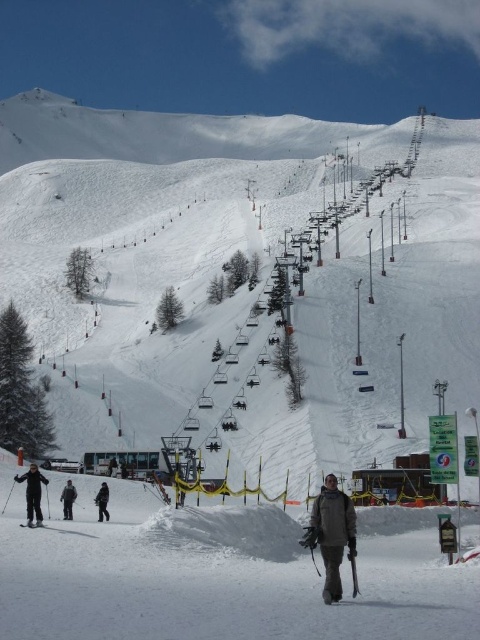
You are a photographer standing at the top of the mountain, looking down at the scene. You want to take a photo that includes both the dark gray jacket at lower center and the black matte jacket at lower left. Which jacket will appear closer to the bottom of the photo?

The black matte jacket at lower left will appear closer to the bottom of the photo because the dark gray jacket at lower center is located above it.

You are a photographer positioned at the top of the mountain. You notice the black matte skis at lower left and the black matte snowboarder at lower left in your viewfinder. Which object should you pan your camera to the left to capture better?

To capture the black matte skis at lower left better, you should pan your camera to the left since the black matte skis at lower left is already positioned to the left of the black matte snowboarder at lower left in the scene.